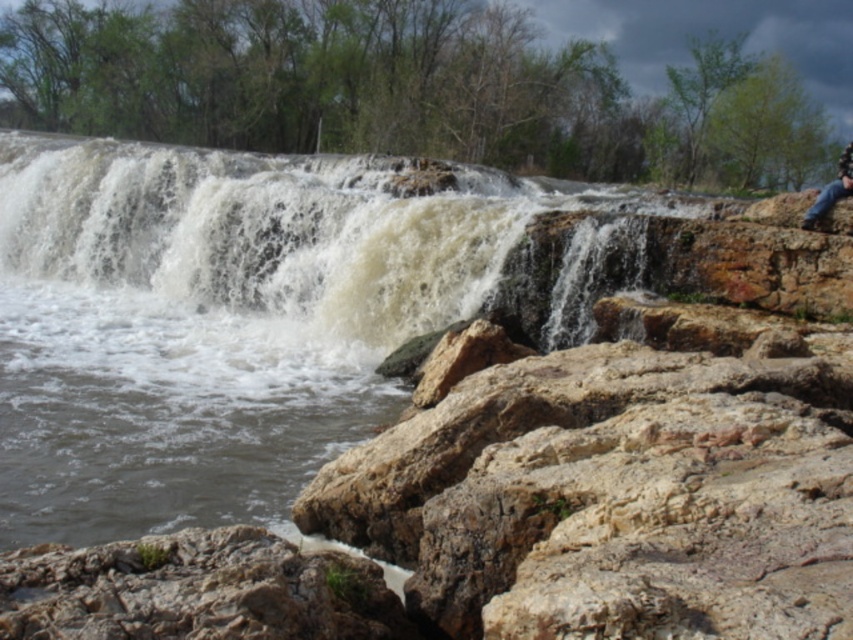
Can you confirm if white frothy water at center is shorter than jeans at right?

Indeed, white frothy water at center has a lesser height compared to jeans at right.

Is white frothy water at center below jeans at right?

Yes.

Between point (225, 225) and point (811, 205), which one is positioned in front?

Point (811, 205) is in front.

I want to click on white frothy water at center, so click(251, 248).